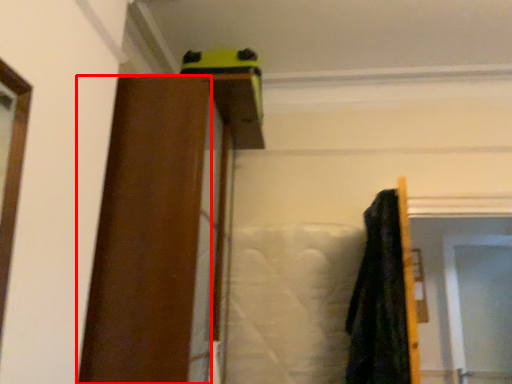
Question: Observing the image, what is the correct spatial positioning of barn door (annotated by the red box) in reference to screen door?

Choices:
 (A) left
 (B) right

Answer: (A)